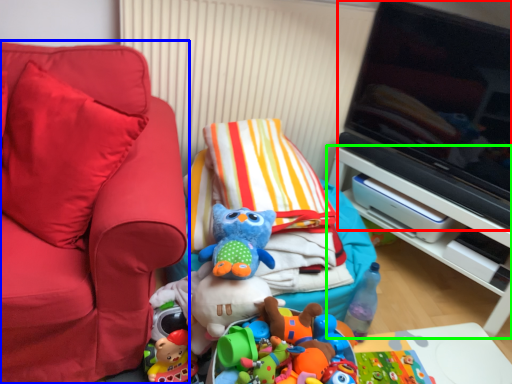
Question: Which object is the closest to the television (highlighted by a red box)? Choose among these: furniture (highlighted by a blue box) or furniture (highlighted by a green box).

Choices:
 (A) furniture
 (B) furniture

Answer: (B)